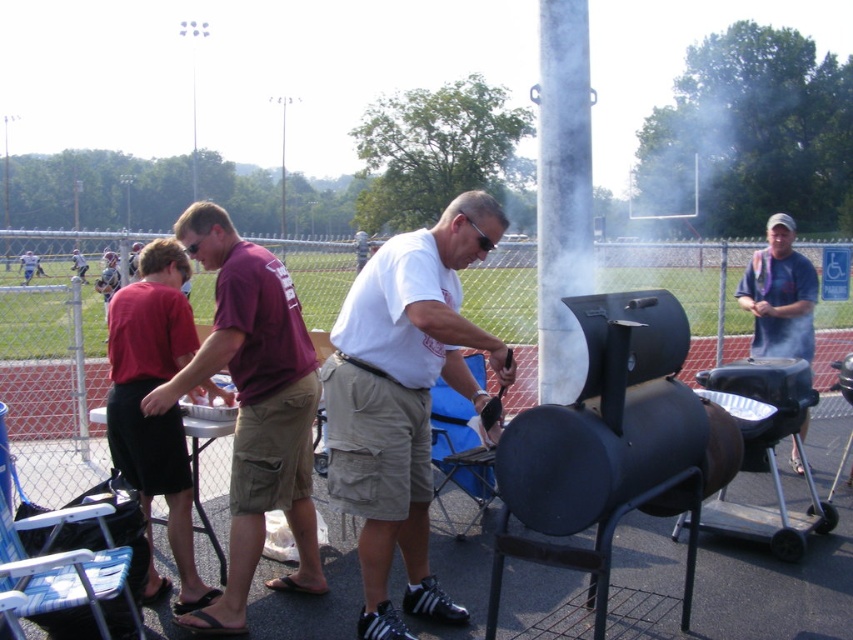
You are a photographer at the event and want to capture both the white matte shirt at center and the maroon fabric shirt at center in a single photo. Which shirt should you focus on to ensure both are fully visible in the frame?

The white matte shirt at center has a larger width than the maroon fabric shirt at center, so focusing on the white matte shirt at center will ensure both are fully visible in the frame.

You are standing at the baseball field and want to walk to the barbecue grill. There are two points marked on the field. Which point should you walk towards first if you want to reach the barbecue grill more quickly? The points are point (344, 392) and point (305, 452).

Point (344, 392) is in front of point (305, 452), so you should walk towards point (344, 392) first to reach the barbecue grill more quickly.

You are standing at the camera position and want to throw a ball to a friend. There are two points marked in the scene, point A at coordinates point (x=646, y=621) and point B at coordinates point (x=318, y=593). Which point should you aim for if you want to throw the ball to the closer one?

You should aim for point A at coordinates point (x=646, y=621) because it is closer to the camera than point B at coordinates point (x=318, y=593).